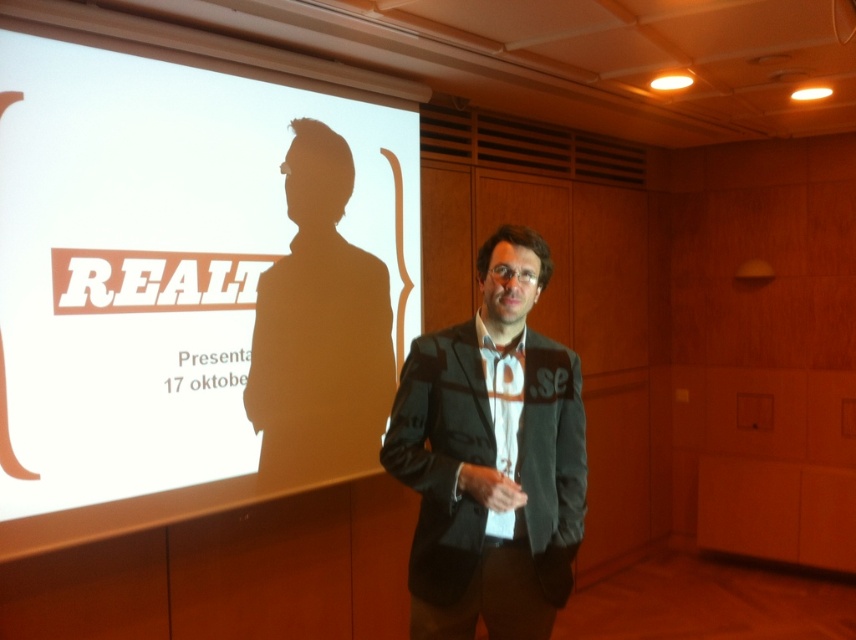
Question: Where is dark gray suit at center located in relation to black matte suit at center in the image?

Choices:
 (A) right
 (B) left

Answer: (A)

Question: Which of the following is the farthest from the observer?

Choices:
 (A) (550, 608)
 (B) (376, 241)

Answer: (B)

Question: Does white matte projection screen at upper left have a smaller size compared to dark gray suit at center?

Choices:
 (A) yes
 (B) no

Answer: (B)

Question: Estimate the real-world distances between objects in this image. Which object is closer to the black matte suit at center?

Choices:
 (A) white matte projection screen at upper left
 (B) dark gray suit at center

Answer: (A)

Question: Does white matte projection screen at upper left appear on the right side of black matte suit at center?

Choices:
 (A) no
 (B) yes

Answer: (A)

Question: Which of the following is the farthest from the observer?

Choices:
 (A) (135, 115)
 (B) (337, 349)
 (C) (580, 516)

Answer: (B)